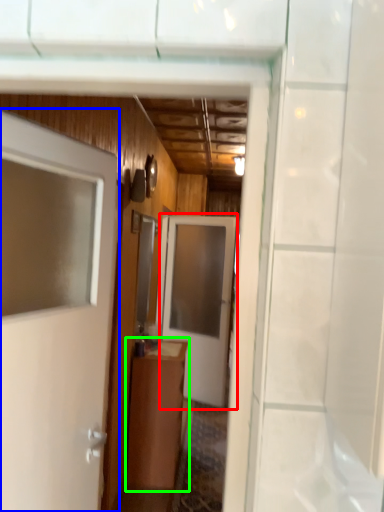
Question: Considering the real-world distances, which object is closest to door (highlighted by a red box)? door (highlighted by a blue box) or cabinetry (highlighted by a green box).

Choices:
 (A) door
 (B) cabinetry

Answer: (B)